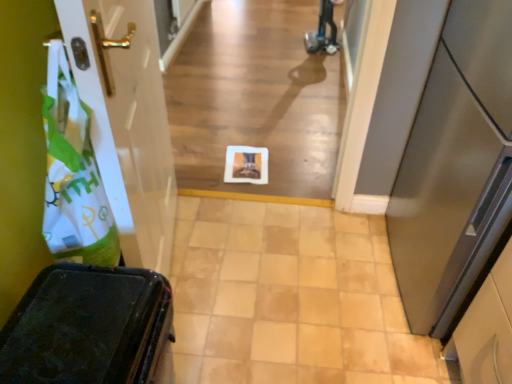
Question: Considering the relative sizes of satin silver door at right, which is counted as the second door, starting from the left, and white matte plastic bag at left in the image provided, is satin silver door at right, which is counted as the second door, starting from the left, thinner than white matte plastic bag at left?

Choices:
 (A) yes
 (B) no

Answer: (B)

Question: Can you confirm if satin silver door at right, which is counted as the second door, starting from the left, is positioned to the right of white matte plastic bag at left?

Choices:
 (A) yes
 (B) no

Answer: (A)

Question: Is satin silver door at right, arranged as the first door when viewed from the right, wider than white matte plastic bag at left?

Choices:
 (A) no
 (B) yes

Answer: (B)

Question: Is satin silver door at right, arranged as the first door when viewed from the right, oriented away from white matte plastic bag at left?

Choices:
 (A) no
 (B) yes

Answer: (A)

Question: From the image's perspective, is satin silver door at right, which is counted as the second door, starting from the left, above white matte plastic bag at left?

Choices:
 (A) yes
 (B) no

Answer: (B)

Question: From the image's perspective, is satin silver door at right, which is counted as the second door, starting from the left, beneath white matte plastic bag at left?

Choices:
 (A) no
 (B) yes

Answer: (B)

Question: Considering the relative sizes of beige tile floor at center and matte black suitcase at lower left in the image provided, is beige tile floor at center smaller than matte black suitcase at lower left?

Choices:
 (A) yes
 (B) no

Answer: (A)

Question: Is beige tile floor at center completely or partially outside of matte black suitcase at lower left?

Choices:
 (A) no
 (B) yes

Answer: (B)

Question: Is beige tile floor at center to the left of matte black suitcase at lower left from the viewer's perspective?

Choices:
 (A) no
 (B) yes

Answer: (A)

Question: Is beige tile floor at center positioned behind matte black suitcase at lower left?

Choices:
 (A) no
 (B) yes

Answer: (B)

Question: Considering the relative positions of beige tile floor at center and matte black suitcase at lower left in the image provided, is beige tile floor at center to the right of matte black suitcase at lower left from the viewer's perspective?

Choices:
 (A) yes
 (B) no

Answer: (A)

Question: Does beige tile floor at center have a lesser width compared to matte black suitcase at lower left?

Choices:
 (A) no
 (B) yes

Answer: (A)

Question: Does white matte plastic bag at left appear on the right side of white paper at center?

Choices:
 (A) yes
 (B) no

Answer: (B)